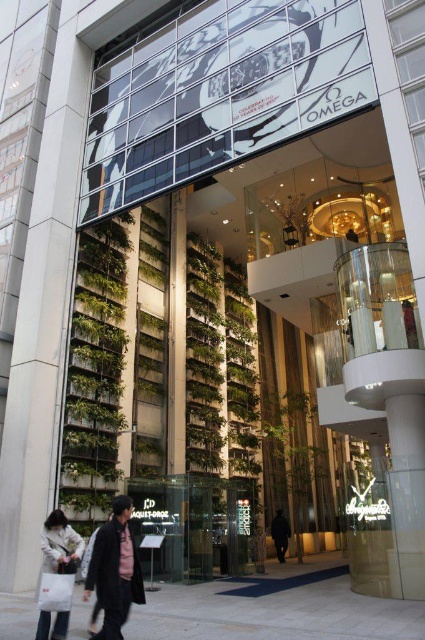
From the picture: You are standing in front of the modern building and see the dark gray jacket at center. If you want to take a photo of the jacket while avoiding the Omega advertisement on the upper glass, where should you position yourself relative to the jacket?

Since the Omega advertisement is on the upper section of the glass facade, positioning yourself below the jacket at center would allow you to avoid capturing the advertisement in your photo.

You are standing in front of the modern, upscale building and want to take a photo of both the Omega advertisement and the vertical gardens. You notice two points marked on the ground at coordinates point (90, 376) and point (67, 624). Which point should you stand at to ensure both the advertisement and the gardens are fully visible in your photo?

You should stand at point (67, 624) because point (90, 376) is behind it, so standing at the latter would block the view of the advertisement and gardens.

You are standing in front of the modern building and want to touch both the green leafy plant at left and the dark gray jacket at center. Which object can you reach first without moving your position?

The green leafy plant at left can be reached first because it is closer to you than the dark gray jacket at center.